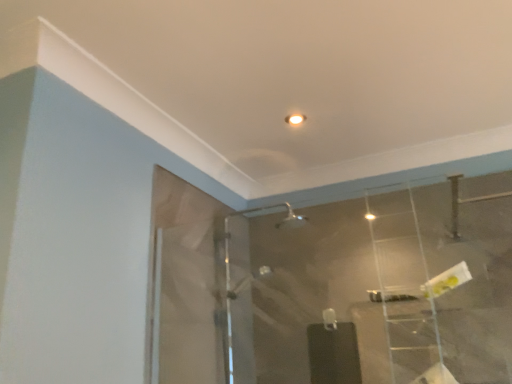
Question: Considering the positions of point (395, 203) and point (455, 183), is point (395, 203) closer or farther from the camera than point (455, 183)?

Choices:
 (A) farther
 (B) closer

Answer: (A)

Question: Considering their positions, is clear plastic ladder at upper right located in front of or behind transparent glass mirror at center?

Choices:
 (A) behind
 (B) front

Answer: (A)

Question: In terms of height, does clear plastic ladder at upper right look taller or shorter compared to transparent glass mirror at center?

Choices:
 (A) tall
 (B) short

Answer: (A)

Question: Considering the positions of transparent glass mirror at center and clear plastic ladder at upper right in the image, is transparent glass mirror at center taller or shorter than clear plastic ladder at upper right?

Choices:
 (A) tall
 (B) short

Answer: (B)

Question: Does point (496, 331) appear closer or farther from the camera than point (380, 198)?

Choices:
 (A) closer
 (B) farther

Answer: (A)

Question: Based on their positions, is transparent glass mirror at center located to the left or right of clear plastic ladder at upper right?

Choices:
 (A) right
 (B) left

Answer: (B)

Question: In the image, is transparent glass mirror at center positioned in front of or behind clear plastic ladder at upper right?

Choices:
 (A) front
 (B) behind

Answer: (A)